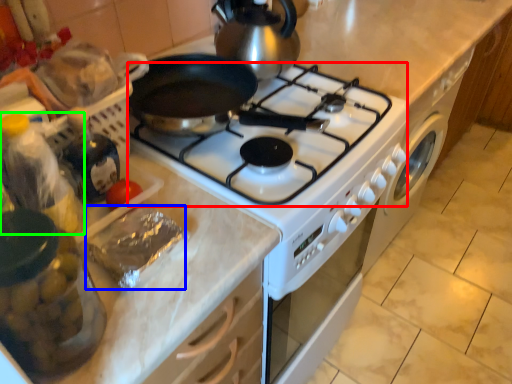
Question: Estimate the real-world distances between objects in this image. Which object is farther from gas stove (highlighted by a red box), food (highlighted by a blue box) or bottle (highlighted by a green box)?

Choices:
 (A) food
 (B) bottle

Answer: (B)